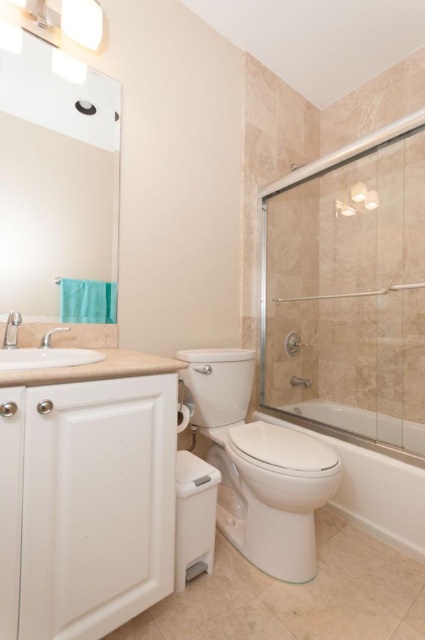
You are standing in the bathroom and want to wash your hands. Which object should you approach first, the white glossy toilet at center or the white porcelain sink at left?

You should approach the white porcelain sink at left first because it is closer to you than the white glossy toilet at center, which is further away.

You are standing in the bathroom and want to place a small plant between the two points labeled point (255,512) and point (399,509). Which point should the plant be closer to in order to be positioned between them?

The plant should be closer to point (255,512) because it is in front of point (399,509).